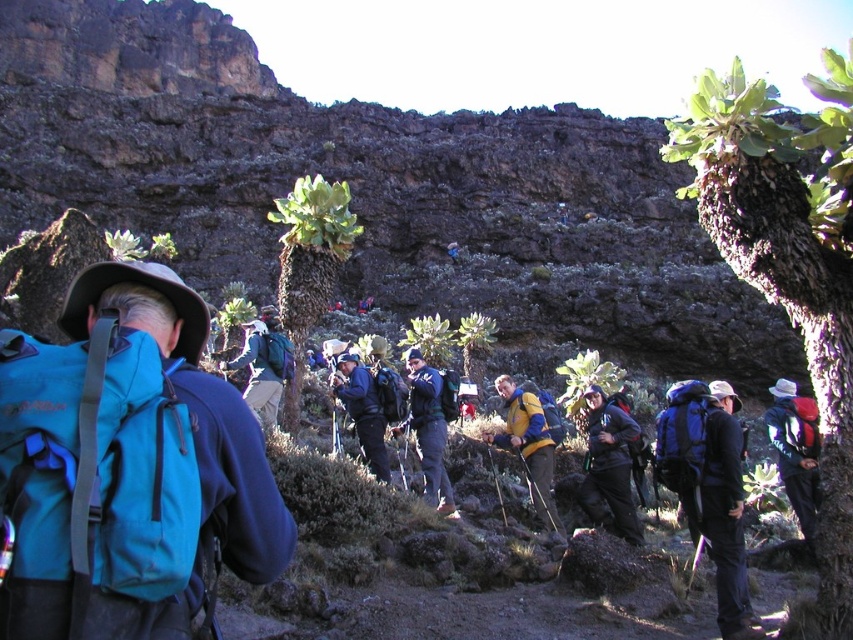
Is black fabric jacket at center-right wider than matte blue jacket at center?

Yes, black fabric jacket at center-right is wider than matte blue jacket at center.

Between point (737, 396) and point (430, 440), which one is positioned behind?

Point (737, 396)

Does point (721, 392) lie in front of point (410, 420)?

Yes, it is in front of point (410, 420).

You are a GUI agent. You are given a task and a screenshot of the screen. Output one action in this format:
    pyautogui.click(x=<x>, y=<y>)
    Task: Click on the black fabric jacket at center-right
    
    Given the screenshot: What is the action you would take?
    pyautogui.click(x=724, y=513)

Based on the photo, who is higher up, teal fabric backpack at left or matte blue backpack at center?

Positioned higher is teal fabric backpack at left.

Is teal fabric backpack at left in front of matte blue backpack at center?

That is True.

Who is more distant from viewer, (93, 563) or (781, 406)?

The point (781, 406) is behind.

Image resolution: width=853 pixels, height=640 pixels. In order to click on teal fabric backpack at left in this screenshot , I will do `click(126, 467)`.

The image size is (853, 640). Describe the element at coordinates (126, 467) in the screenshot. I see `teal fabric backpack at left` at that location.

In order to click on teal fabric backpack at left in this screenshot , I will do `click(126, 467)`.